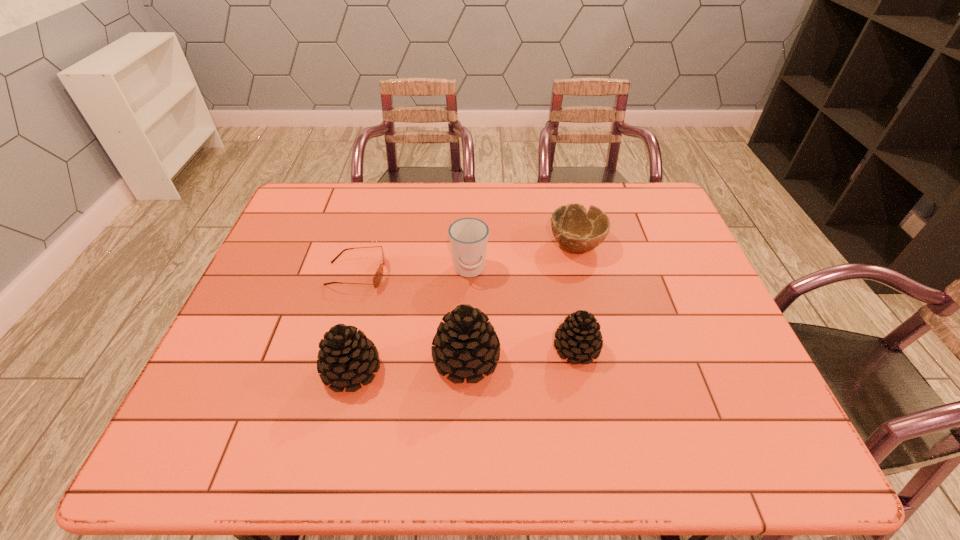
Find the location of a particular element. the second tallest pinecone is located at coordinates (346, 357).

You are a GUI agent. You are given a task and a screenshot of the screen. Output one action in this format:
    pyautogui.click(x=<x>, y=<y>)
    Task: Click on the second pinecone from right to left
    The width and height of the screenshot is (960, 540).
    Given the screenshot: What is the action you would take?
    pyautogui.click(x=466, y=344)

At what (x,y) coordinates should I click in order to perform the action: click on the shortest pinecone. Please return your answer as a coordinate pair (x, y). The image size is (960, 540). Looking at the image, I should click on (579, 336).

The height and width of the screenshot is (540, 960). I want to click on bowl, so click(x=577, y=230).

This screenshot has width=960, height=540. Identify the location of sunglasses. (377, 278).

Identify the location of cup. This screenshot has height=540, width=960. (468, 237).

The width and height of the screenshot is (960, 540). In order to click on free space located 0.380m at the narrow end of the second tallest pinecone in this screenshot , I will do `click(545, 370)`.

Identify the location of free space located 0.090m at the narrow end of the second pinecone from right to left. Image resolution: width=960 pixels, height=540 pixels. (538, 359).

At what (x,y) coordinates should I click in order to perform the action: click on vacant space situated 0.160m at the narrow end of the shortest pinecone. Please return your answer as a coordinate pair (x, y). This screenshot has height=540, width=960. Looking at the image, I should click on (666, 348).

Where is `free space located on the back of the second shortest object`? This screenshot has height=540, width=960. free space located on the back of the second shortest object is located at coordinates (562, 184).